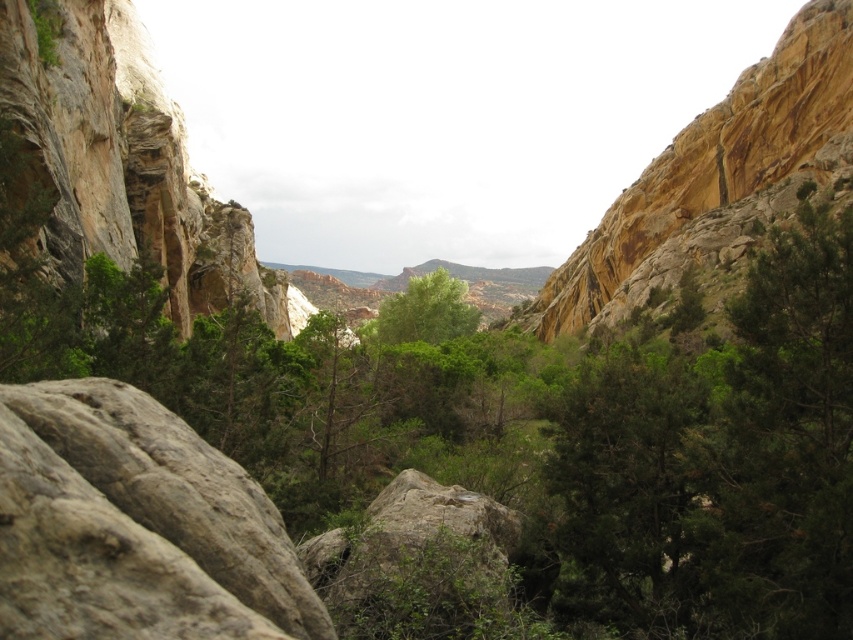
Is gray rough rock at lower left wider than green leafy tree at center?

No.

Who is more distant from viewer, (x=236, y=596) or (x=398, y=300)?

Point (x=398, y=300)

The width and height of the screenshot is (853, 640). I want to click on gray rough rock at lower left, so click(x=177, y=490).

Between yellowish rock cliff at right and gray rough rock at lower left, which one is positioned lower?

gray rough rock at lower left

Locate an element on the screen. This screenshot has height=640, width=853. yellowish rock cliff at right is located at coordinates (712, 172).

In the scene shown: Does yellowish rock cliff at right lie behind green leafy tree at center?

No, it is not.

Consider the image. Is yellowish rock cliff at right wider than green leafy tree at center?

Indeed, yellowish rock cliff at right has a greater width compared to green leafy tree at center.

Which is behind, point (846, 45) or point (415, 326)?

The point (415, 326) is behind.

Locate an element on the screen. The height and width of the screenshot is (640, 853). yellowish rock cliff at right is located at coordinates (712, 172).